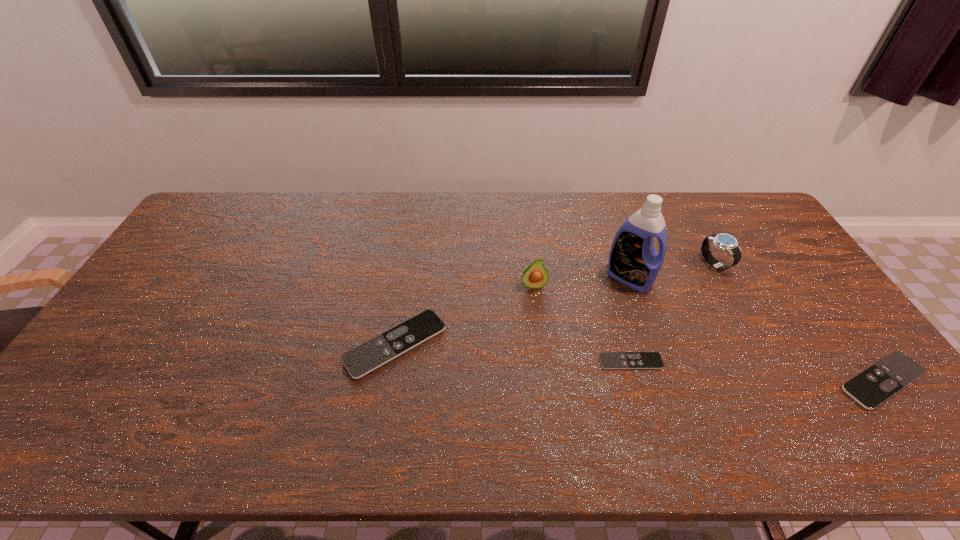
Locate an element on the screen. This screenshot has width=960, height=540. the closest object to the detergent is located at coordinates (725, 242).

Choose which remote control is the nearest neighbor to the avocado. Please provide its 2D coordinates. Your answer should be formatted as a tuple, i.e. [(x, y)], where the tuple contains the x and y coordinates of a point satisfying the conditions above.

[(365, 358)]

Select which remote control is the closest to the leftmost remote control. Please provide its 2D coordinates. Your answer should be formatted as a tuple, i.e. [(x, y)], where the tuple contains the x and y coordinates of a point satisfying the conditions above.

[(609, 360)]

Identify the location of free space that satisfies the following two spatial constraints: 1. on the front side of the second shortest remote control; 2. on the left side of the third tallest object. Image resolution: width=960 pixels, height=540 pixels. (779, 381).

The image size is (960, 540). Identify the location of free space in the image that satisfies the following two spatial constraints: 1. on the front side of the watch; 2. on the right side of the fifth tallest object. (779, 381).

Locate an element on the screen. This screenshot has height=540, width=960. free space that satisfies the following two spatial constraints: 1. on the cut side of the rightmost remote control; 2. on the right side of the fifth shortest object is located at coordinates (544, 381).